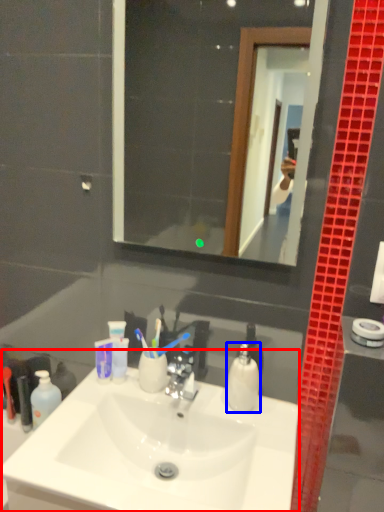
Question: Which point is further to the camera, sink (highlighted by a red box) or soap dispenser (highlighted by a blue box)?

Choices:
 (A) sink
 (B) soap dispenser

Answer: (B)